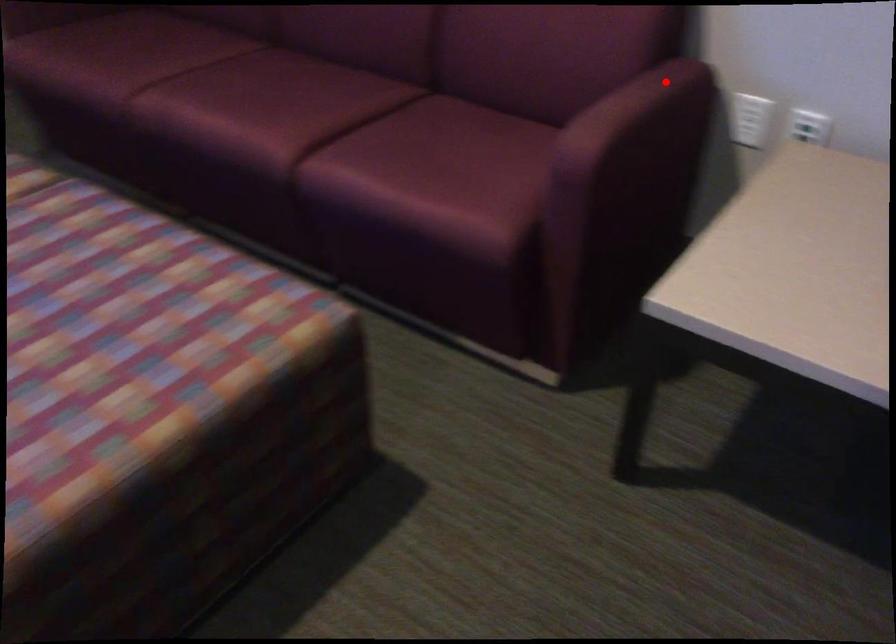
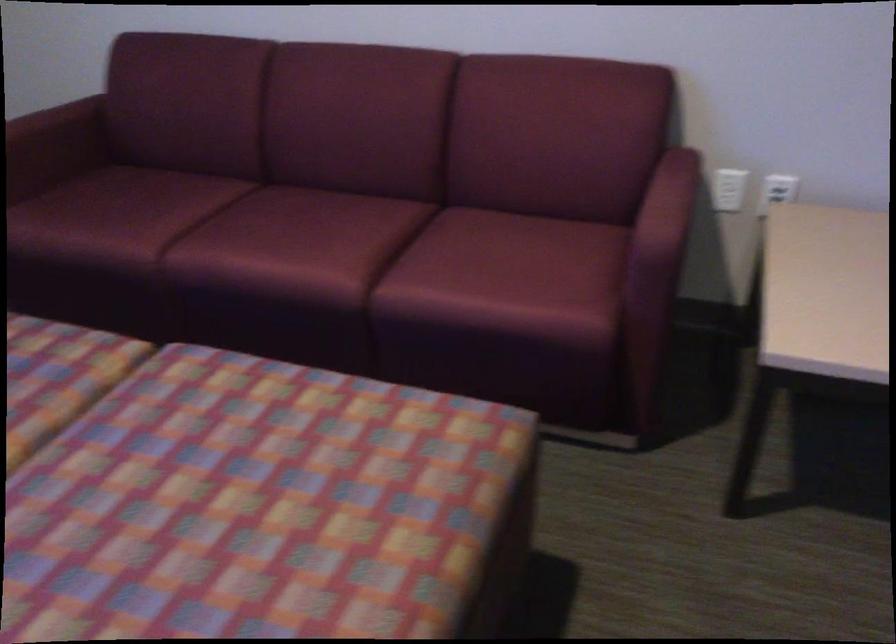
Question: A red point is marked in image1. In image2, is the corresponding 3D point closer to the camera or farther? Reply with the corresponding letter.

Choices:
 (A) The corresponding 3D point is closer.
 (B) The corresponding 3D point is farther.

Answer: (B)